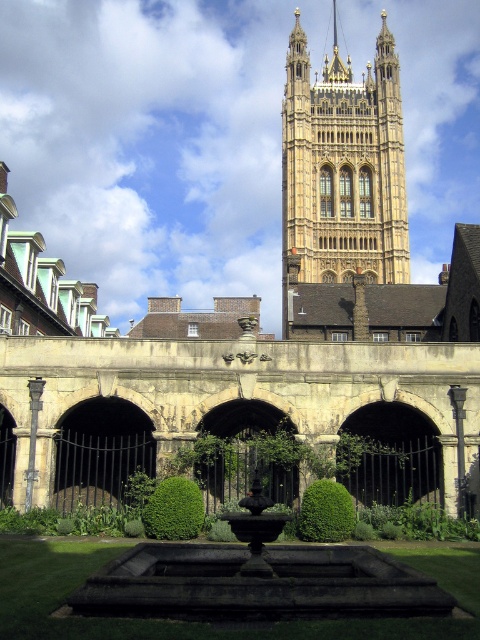
You are a tourist standing at the entrance of the courtyard, facing the golden stone tower at upper center and the dark stone fountain at center. Which structure would you look up more to see?

The golden stone tower at upper center is taller than the dark stone fountain at center, so you would need to look up more to see the golden stone tower at upper center.

You are standing in the courtyard of the historic building and want to take a photo of the tower. You notice two points marked on the ground in front of you. The first point is at coordinate point(382, 16) and the second is at point(261, 525). Which point is closer to you as you face the tower?

Point(382, 16) is closer to you because it is further to the viewer than point(261, 525).